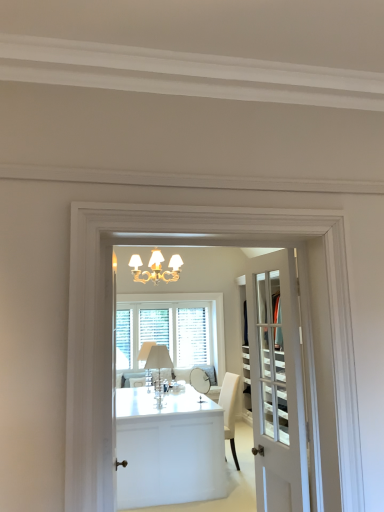
Question: Is white glossy cabinet at center at the back of white glass door at center?

Choices:
 (A) yes
 (B) no

Answer: (B)

Question: Is white glass door at center at the left side of white glossy cabinet at center?

Choices:
 (A) yes
 (B) no

Answer: (B)

Question: Is white glass door at center surrounding white glossy cabinet at center?

Choices:
 (A) yes
 (B) no

Answer: (B)

Question: Can you confirm if white glass door at center is positioned to the right of white glossy cabinet at center?

Choices:
 (A) yes
 (B) no

Answer: (A)

Question: Can you confirm if white glass door at center is thinner than white glossy cabinet at center?

Choices:
 (A) yes
 (B) no

Answer: (A)

Question: In the image, is white glossy cabinet at center on the left side or the right side of white glass door at center?

Choices:
 (A) left
 (B) right

Answer: (A)

Question: Relative to white glass door at center, is white glossy cabinet at center in front or behind?

Choices:
 (A) front
 (B) behind

Answer: (B)

Question: From a real-world perspective, is white glossy cabinet at center physically located above or below white glass door at center?

Choices:
 (A) below
 (B) above

Answer: (A)

Question: Which is correct: white glossy cabinet at center is inside white glass door at center, or outside of it?

Choices:
 (A) inside
 (B) outside

Answer: (B)

Question: From their relative heights in the image, would you say white glass door at center is taller or shorter than white glossy cabinet at center?

Choices:
 (A) short
 (B) tall

Answer: (B)

Question: Looking at their shapes, would you say white glass door at center is wider or thinner than white glossy cabinet at center?

Choices:
 (A) wide
 (B) thin

Answer: (B)

Question: Considering the positions of white glass door at center and white glossy cabinet at center in the image, is white glass door at center bigger or smaller than white glossy cabinet at center?

Choices:
 (A) big
 (B) small

Answer: (B)

Question: Visually, is white glass door at center positioned to the left or to the right of white glossy cabinet at center?

Choices:
 (A) right
 (B) left

Answer: (A)

Question: From the image's perspective, relative to white wood window at center, is white glossy cabinet at center above or below?

Choices:
 (A) below
 (B) above

Answer: (A)

Question: From a real-world perspective, is white glossy cabinet at center physically located above or below white wood window at center?

Choices:
 (A) below
 (B) above

Answer: (A)